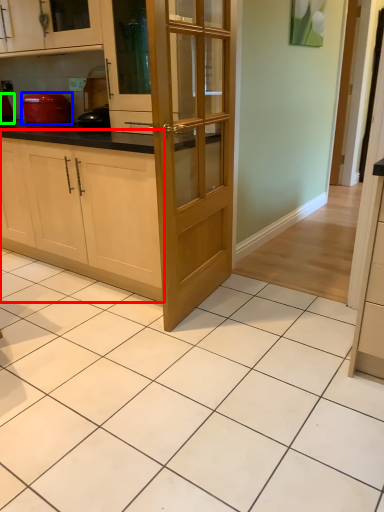
Question: Which object is positioned farthest from cabinetry (highlighted by a red box)? Select from kitchen appliance (highlighted by a blue box) and appliance (highlighted by a green box).

Choices:
 (A) kitchen appliance
 (B) appliance

Answer: (B)